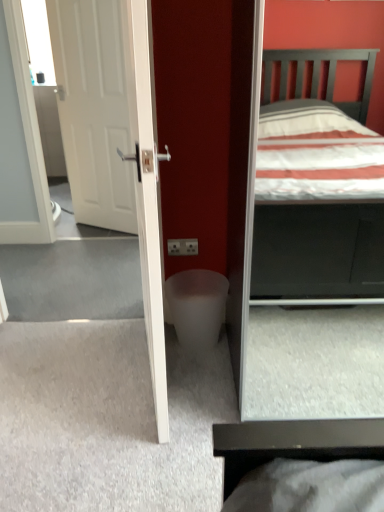
Where is `free location to the left of white frosted glass at center`? Image resolution: width=384 pixels, height=512 pixels. free location to the left of white frosted glass at center is located at coordinates (146, 354).